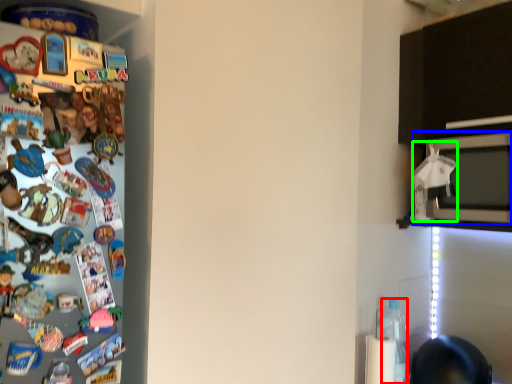
Question: Estimate the real-world distances between objects in this image. Which object is farther from bottle (highlighted by a red box), microwave oven (highlighted by a blue box) or toy (highlighted by a green box)?

Choices:
 (A) microwave oven
 (B) toy

Answer: (A)